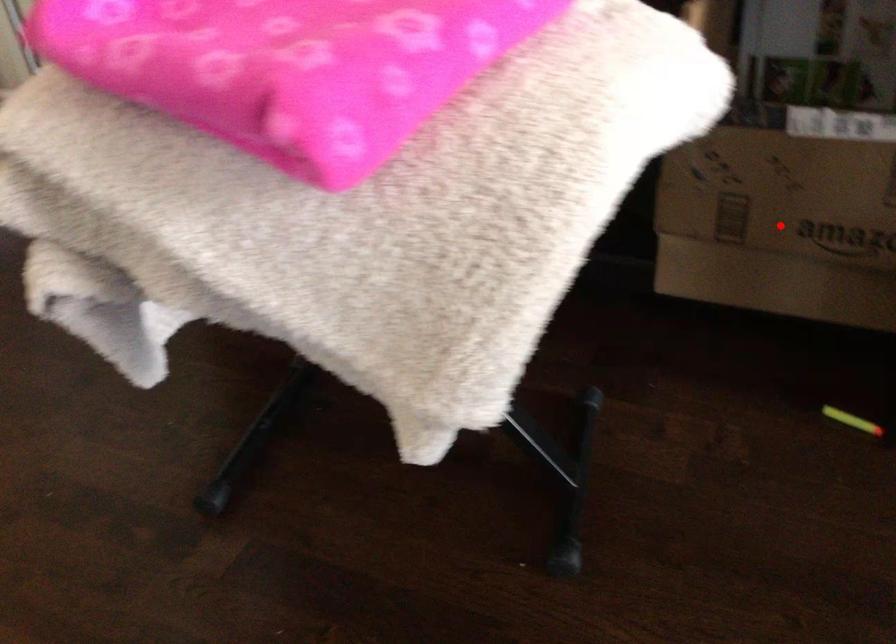
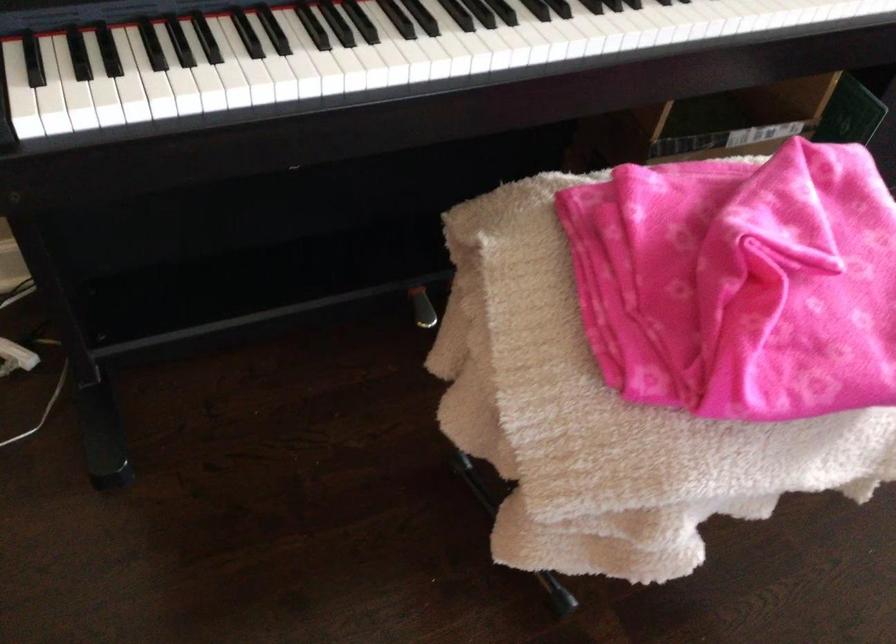
Question: I am providing you with two images of the same scene from different viewpoints. A red point is marked on the first image. At the location where the point appears in image 1, is it still visible in image 2?

Choices:
 (A) Yes
 (B) No

Answer: (B)